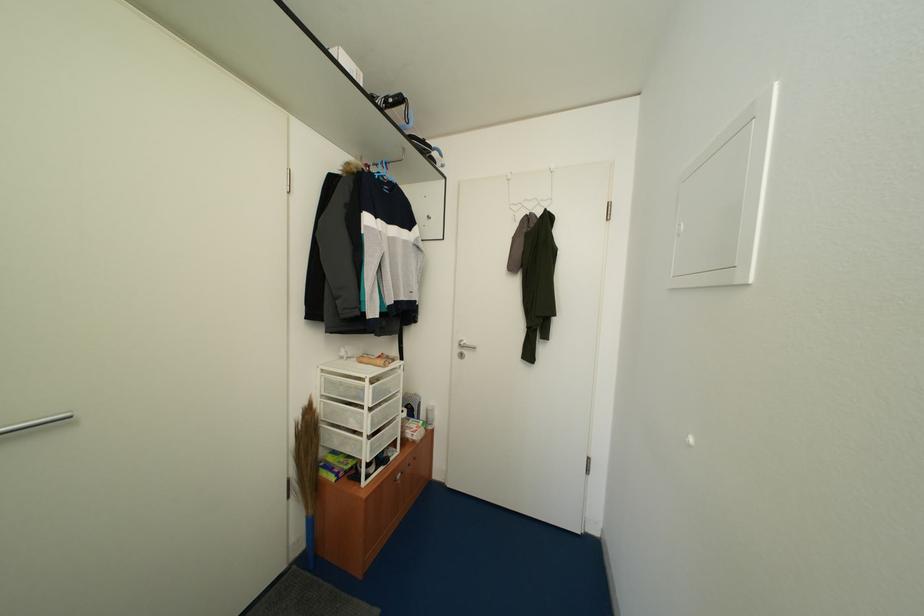
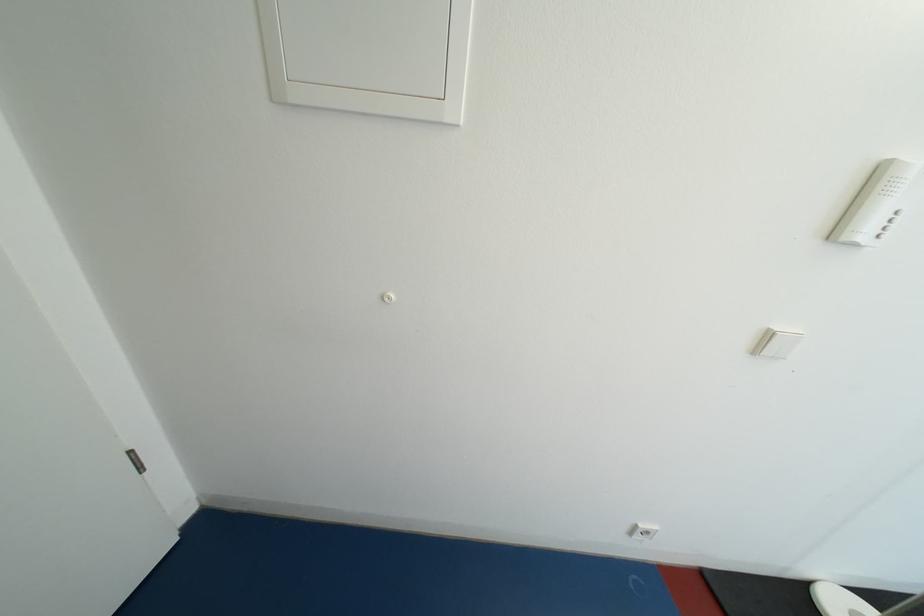
First-person continuous shooting, in which direction is the camera rotating?

The camera's rotation is toward right-down.